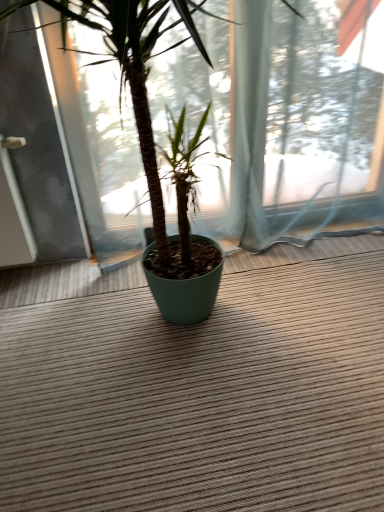
Question: Are green textured pot at center and brown textured doormat at center making contact?

Choices:
 (A) no
 (B) yes

Answer: (A)

Question: Is green textured pot at center at the left side of brown textured doormat at center?

Choices:
 (A) yes
 (B) no

Answer: (A)

Question: From the image's perspective, is green textured pot at center located beneath brown textured doormat at center?

Choices:
 (A) no
 (B) yes

Answer: (A)

Question: Does green textured pot at center have a larger size compared to brown textured doormat at center?

Choices:
 (A) yes
 (B) no

Answer: (A)

Question: Considering the relative positions of green textured pot at center and brown textured doormat at center in the image provided, is green textured pot at center to the right of brown textured doormat at center from the viewer's perspective?

Choices:
 (A) no
 (B) yes

Answer: (A)

Question: From the image's perspective, does green textured pot at center appear higher than brown textured doormat at center?

Choices:
 (A) yes
 (B) no

Answer: (A)

Question: Considering the relative sizes of brown textured doormat at center and green textured pot at center in the image provided, is brown textured doormat at center wider than green textured pot at center?

Choices:
 (A) yes
 (B) no

Answer: (A)

Question: Is brown textured doormat at center taller than green textured pot at center?

Choices:
 (A) no
 (B) yes

Answer: (A)

Question: Can you confirm if brown textured doormat at center is thinner than green textured pot at center?

Choices:
 (A) no
 (B) yes

Answer: (A)

Question: Is green textured pot at center completely or partially inside brown textured doormat at center?

Choices:
 (A) yes
 (B) no

Answer: (B)

Question: Would you say brown textured doormat at center is outside green textured pot at center?

Choices:
 (A) no
 (B) yes

Answer: (B)

Question: Is brown textured doormat at center behind green textured pot at center?

Choices:
 (A) no
 (B) yes

Answer: (B)

Question: Is point (317, 301) closer or farther from the camera than point (145, 125)?

Choices:
 (A) closer
 (B) farther

Answer: (B)